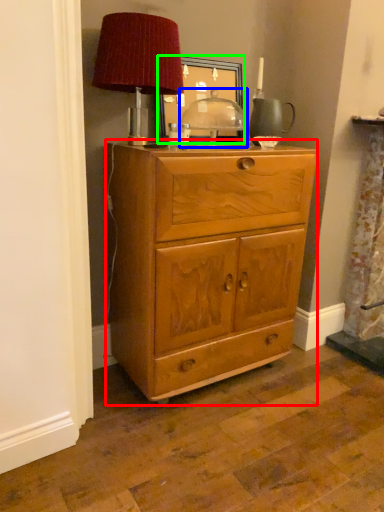
Question: Considering the real-world distances, which object is farthest from chest of drawers (highlighted by a red box)? table (highlighted by a blue box) or picture frame (highlighted by a green box)?

Choices:
 (A) table
 (B) picture frame

Answer: (B)